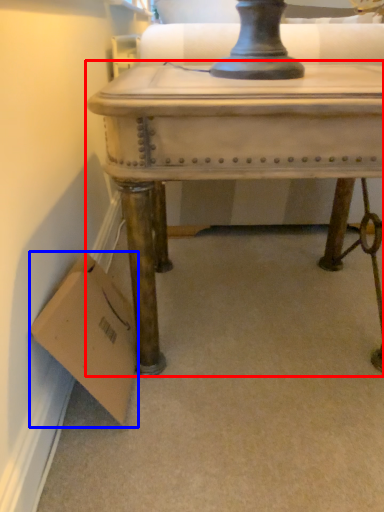
Question: Which point is closer to the camera, table (highlighted by a red box) or cardboard box (highlighted by a blue box)?

Choices:
 (A) table
 (B) cardboard box

Answer: (A)